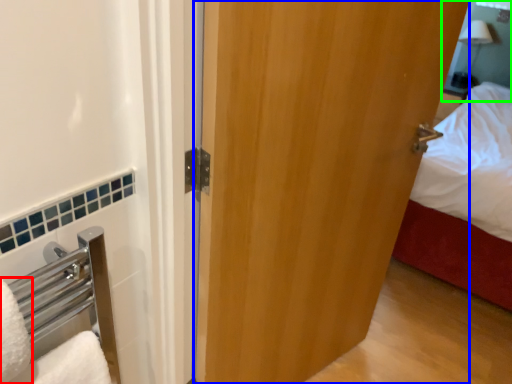
Question: Estimate the real-world distances between objects in this image. Which object is closer to bath towel (highlighted by a red box), door (highlighted by a blue box) or mirror (highlighted by a green box)?

Choices:
 (A) door
 (B) mirror

Answer: (A)